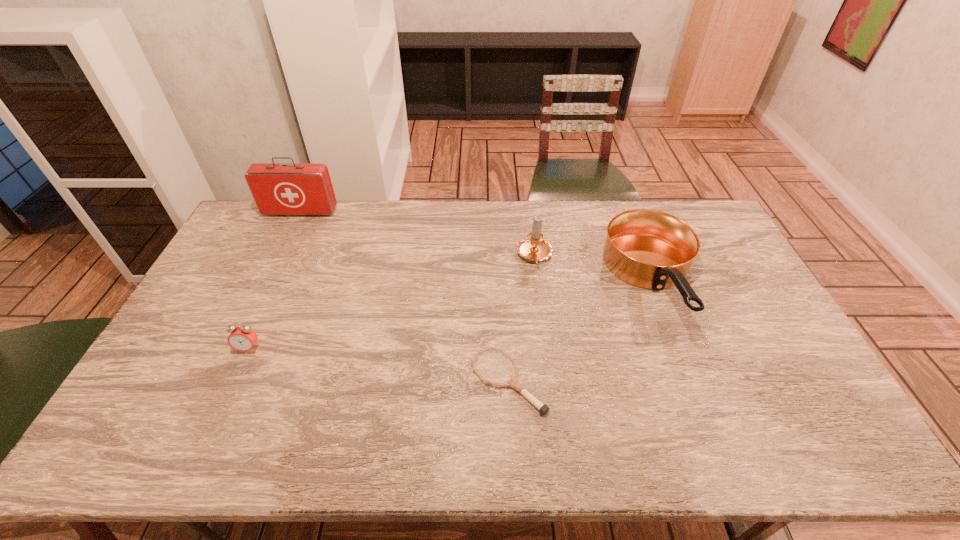
In the image, there is a desktop. At what (x,y) coordinates should I click in order to perform the action: click on vacant space at the far right corner. Please return your answer as a coordinate pair (x, y). Image resolution: width=960 pixels, height=540 pixels. Looking at the image, I should click on (709, 238).

At what (x,y) coordinates should I click in order to perform the action: click on free space between the rightmost object and the candle. Please return your answer as a coordinate pair (x, y). Looking at the image, I should click on (594, 270).

Find the location of a particular element. This screenshot has width=960, height=540. free space between the frying pan and the candle is located at coordinates (594, 270).

Find the location of `vacant area that lies between the candle and the tennis racket`. vacant area that lies between the candle and the tennis racket is located at coordinates (521, 319).

Locate an element on the screen. The image size is (960, 540). unoccupied area between the second shortest object and the tallest object is located at coordinates (275, 280).

Locate an element on the screen. This screenshot has width=960, height=540. free spot between the tennis racket and the farthest object is located at coordinates (404, 297).

Locate an element on the screen. The width and height of the screenshot is (960, 540). free point between the tennis racket and the second shortest object is located at coordinates pyautogui.click(x=378, y=365).

Find the location of `unoccupied position between the alarm clock and the first-aid kit`. unoccupied position between the alarm clock and the first-aid kit is located at coordinates (275, 280).

Find the location of `empty location between the candle and the farthest object`. empty location between the candle and the farthest object is located at coordinates (418, 234).

Identify the location of free space between the rightmost object and the first-aid kit. (477, 248).